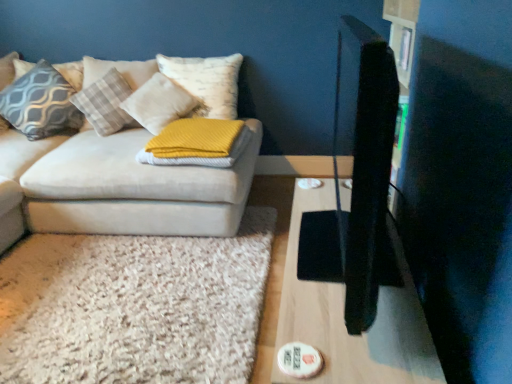
How much space does patterned fabric pillow at upper left, placed as the 5th pillow when sorted from right to left, occupy horizontally?

It is 10.26 inches.

What is the approximate width of yellow textured pillow at center, the fourth pillow in the left-to-right sequence?

The width of yellow textured pillow at center, the fourth pillow in the left-to-right sequence, is 15.34 inches.

What do you see at coordinates (42, 102) in the screenshot? I see `matte gray pillow at left, which is counted as the fourth pillow, starting from the right` at bounding box center [42, 102].

In order to click on plush white pillow at upper left, the third pillow when ordered from left to right in this screenshot , I will do `click(105, 103)`.

The image size is (512, 384). I want to click on yellow knitted blanket at center, which ranks as the 5th pillow in left-to-right order, so click(197, 143).

The width and height of the screenshot is (512, 384). In order to click on patterned fabric pillow at upper left, placed as the 5th pillow when sorted from right to left in this screenshot , I will do `click(72, 73)`.

From the picture: Choose the correct answer: Is plush white pillow at upper left, the third pillow when ordered from left to right, inside matte gray pillow at left, which is counted as the fourth pillow, starting from the right, or outside it?

plush white pillow at upper left, the third pillow when ordered from left to right, is located beyond the bounds of matte gray pillow at left, which is counted as the fourth pillow, starting from the right.

Considering the relative positions of plush white pillow at upper left, which is the 3th pillow from right to left, and matte gray pillow at left, placed as the 2th pillow when sorted from left to right, in the image provided, is plush white pillow at upper left, which is the 3th pillow from right to left, behind matte gray pillow at left, placed as the 2th pillow when sorted from left to right,?

That is False.

From the matte gray pillow at left, which is counted as the fourth pillow, starting from the right, count 1st pillows forward and point to it. Please provide its 2D coordinates.

[(105, 103)]

From a real-world perspective, is plush white pillow at upper left, which is the 3th pillow from right to left, over matte gray pillow at left, placed as the 2th pillow when sorted from left to right?

No.

From the image's perspective, between plush white pillow at upper left, the third pillow when ordered from left to right, and patterned fabric pillow at upper left, which appears as the 1th pillow when viewed from the left, who is located below?

From the image's view, plush white pillow at upper left, the third pillow when ordered from left to right, is below.

How distant is plush white pillow at upper left, which is the 3th pillow from right to left, from patterned fabric pillow at upper left, which appears as the 1th pillow when viewed from the left?

They are 11.75 inches apart.

From the image's perspective, which pillow is the 2nd one above the plush white pillow at upper left, which is the 3th pillow from right to left? Please provide its 2D coordinates.

[(72, 73)]

Which object is wider, yellow textured pillow at center, the fourth pillow in the left-to-right sequence, or velvet beige couch at left?

velvet beige couch at left.

Relative to velvet beige couch at left, is yellow textured pillow at center, the 2th pillow in the right-to-left sequence, in front or behind?

Visually, yellow textured pillow at center, the 2th pillow in the right-to-left sequence, is located behind velvet beige couch at left.

Which object is more forward, matte gray pillow at left, which is counted as the fourth pillow, starting from the right, or yellow knitted blanket at center, which ranks as the 5th pillow in left-to-right order?

yellow knitted blanket at center, which ranks as the 5th pillow in left-to-right order, is closer to the camera.

Based on the photo, is matte gray pillow at left, which is counted as the fourth pillow, starting from the right, aimed at yellow knitted blanket at center, which ranks as the 5th pillow in left-to-right order?

No, matte gray pillow at left, which is counted as the fourth pillow, starting from the right, is not aimed at yellow knitted blanket at center, which ranks as the 5th pillow in left-to-right order.

Considering the relative positions of matte gray pillow at left, which is counted as the fourth pillow, starting from the right, and yellow knitted blanket at center, which ranks as the 5th pillow in left-to-right order, in the image provided, is matte gray pillow at left, which is counted as the fourth pillow, starting from the right, to the left or to the right of yellow knitted blanket at center, which ranks as the 5th pillow in left-to-right order,?

Clearly, matte gray pillow at left, which is counted as the fourth pillow, starting from the right, is on the left of yellow knitted blanket at center, which ranks as the 5th pillow in left-to-right order, in the image.

Which of these two, wooden table at right or velvet beige couch at left, stands taller?

velvet beige couch at left.

From the image's perspective, is wooden table at right beneath velvet beige couch at left?

Indeed, from the image's perspective, wooden table at right is shown beneath velvet beige couch at left.

Considering the relative positions of wooden table at right and velvet beige couch at left in the image provided, is wooden table at right to the right of velvet beige couch at left from the viewer's perspective?

Indeed, wooden table at right is positioned on the right side of velvet beige couch at left.

Is wooden table at right in front of or behind velvet beige couch at left in the image?

Visually, wooden table at right is located behind velvet beige couch at left.

Which of these two, yellow knitted blanket at center, which ranks as the 5th pillow in left-to-right order, or matte gray pillow at left, which is counted as the fourth pillow, starting from the right, is bigger?

With larger size is matte gray pillow at left, which is counted as the fourth pillow, starting from the right.

Can you confirm if yellow knitted blanket at center, which ranks as the 5th pillow in left-to-right order, is positioned to the right of matte gray pillow at left, placed as the 2th pillow when sorted from left to right?

Correct, you'll find yellow knitted blanket at center, which ranks as the 5th pillow in left-to-right order, to the right of matte gray pillow at left, placed as the 2th pillow when sorted from left to right.

From their relative heights in the image, would you say yellow knitted blanket at center, which is counted as the 1th pillow, starting from the right, is taller or shorter than matte gray pillow at left, placed as the 2th pillow when sorted from left to right?

Clearly, yellow knitted blanket at center, which is counted as the 1th pillow, starting from the right, is shorter compared to matte gray pillow at left, placed as the 2th pillow when sorted from left to right.

Considering the positions of objects yellow knitted blanket at center, which ranks as the 5th pillow in left-to-right order, and matte gray pillow at left, placed as the 2th pillow when sorted from left to right, in the image provided, who is in front, yellow knitted blanket at center, which ranks as the 5th pillow in left-to-right order, or matte gray pillow at left, placed as the 2th pillow when sorted from left to right,?

yellow knitted blanket at center, which ranks as the 5th pillow in left-to-right order, is in front.

Locate an element on the screen. The width and height of the screenshot is (512, 384). mat above the wooden table at right (from the image's perspective) is located at coordinates (134, 307).

Based on the photo, considering the relative sizes of white shaggy rug at lower left and wooden table at right in the image provided, is white shaggy rug at lower left taller than wooden table at right?

No.

Which of these two, white shaggy rug at lower left or wooden table at right, is wider?

Wider between the two is white shaggy rug at lower left.

From a real-world perspective, does white shaggy rug at lower left stand above wooden table at right?

No, from a real-world perspective, white shaggy rug at lower left is not above wooden table at right.

In order to click on the 1st pillow to the right of the matte gray pillow at left, placed as the 2th pillow when sorted from left to right, counting from the anchor's position in this screenshot , I will do `click(105, 103)`.

The image size is (512, 384). Find the location of `the 2nd pillow below the patterned fabric pillow at upper left, which appears as the 1th pillow when viewed from the left (from a real-world perspective)`. the 2nd pillow below the patterned fabric pillow at upper left, which appears as the 1th pillow when viewed from the left (from a real-world perspective) is located at coordinates (105, 103).

Based on their spatial positions, is white shaggy rug at lower left or yellow textured pillow at center, the 2th pillow in the right-to-left sequence, further from wooden table at right?

yellow textured pillow at center, the 2th pillow in the right-to-left sequence, is positioned further to the anchor wooden table at right.

From the image, which object appears to be nearer to yellow knitted blanket at center, which is counted as the 1th pillow, starting from the right, matte gray pillow at left, which is counted as the fourth pillow, starting from the right, or patterned fabric pillow at upper left, placed as the 5th pillow when sorted from right to left?

matte gray pillow at left, which is counted as the fourth pillow, starting from the right, lies closer to yellow knitted blanket at center, which is counted as the 1th pillow, starting from the right, than the other object.

Which object lies nearer to the anchor point matte gray pillow at left, which is counted as the fourth pillow, starting from the right, white shaggy rug at lower left or patterned fabric pillow at upper left, which appears as the 1th pillow when viewed from the left?

Based on the image, patterned fabric pillow at upper left, which appears as the 1th pillow when viewed from the left, appears to be nearer to matte gray pillow at left, which is counted as the fourth pillow, starting from the right.

From the image, which object appears to be nearer to patterned fabric pillow at upper left, which appears as the 1th pillow when viewed from the left, velvet beige couch at left or yellow knitted blanket at center, which ranks as the 5th pillow in left-to-right order?

velvet beige couch at left.

From the image, which object appears to be farther from white shaggy rug at lower left, patterned fabric pillow at upper left, placed as the 5th pillow when sorted from right to left, or yellow textured pillow at center, the fourth pillow in the left-to-right sequence?

patterned fabric pillow at upper left, placed as the 5th pillow when sorted from right to left, is positioned further to the anchor white shaggy rug at lower left.

In the scene shown: Looking at the image, which one is located further to yellow textured pillow at center, the fourth pillow in the left-to-right sequence, white shaggy rug at lower left or yellow knitted blanket at center, which is counted as the 1th pillow, starting from the right?

white shaggy rug at lower left is further to yellow textured pillow at center, the fourth pillow in the left-to-right sequence.

Which object lies nearer to the anchor point patterned fabric pillow at upper left, which appears as the 1th pillow when viewed from the left, wooden table at right or yellow knitted blanket at center, which is counted as the 1th pillow, starting from the right?

yellow knitted blanket at center, which is counted as the 1th pillow, starting from the right, is positioned closer to the anchor patterned fabric pillow at upper left, which appears as the 1th pillow when viewed from the left.

Based on their spatial positions, is yellow textured pillow at center, the fourth pillow in the left-to-right sequence, or yellow knitted blanket at center, which ranks as the 5th pillow in left-to-right order, further from matte gray pillow at left, placed as the 2th pillow when sorted from left to right?

The object further to matte gray pillow at left, placed as the 2th pillow when sorted from left to right, is yellow knitted blanket at center, which ranks as the 5th pillow in left-to-right order.

You are a GUI agent. You are given a task and a screenshot of the screen. Output one action in this format:
    pyautogui.click(x=<x>, y=<y>)
    Task: Click on the table between velvet beige couch at left and patterned fabric pillow at upper left, which appears as the 1th pillow when viewed from the left, in the front-back direction
    
    Given the screenshot: What is the action you would take?
    pyautogui.click(x=344, y=320)

Identify the location of table between velvet beige couch at left and yellow knitted blanket at center, which ranks as the 5th pillow in left-to-right order, from front to back. Image resolution: width=512 pixels, height=384 pixels. (344, 320).

I want to click on mat between wooden table at right and plush white pillow at upper left, the third pillow when ordered from left to right, in the front-back direction, so click(134, 307).

This screenshot has width=512, height=384. In order to click on mat between wooden table at right and patterned fabric pillow at upper left, placed as the 5th pillow when sorted from right to left, from front to back in this screenshot , I will do `click(134, 307)`.